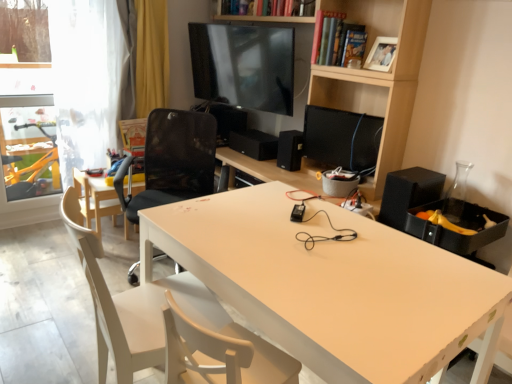
Question: Is white wood chair at lower left, marked as the third chair in a back-to-front arrangement, smaller than black mesh chair at center, which is the second chair in back-to-front order?

Choices:
 (A) no
 (B) yes

Answer: (B)

Question: Is the depth of white wood chair at lower left, which is the 1th chair from front to back, greater than that of black mesh chair at center, which is the second chair in back-to-front order?

Choices:
 (A) no
 (B) yes

Answer: (A)

Question: Is white wood chair at lower left, which is the 1th chair from front to back, outside black mesh chair at center, which is the second chair in front-to-back order?

Choices:
 (A) no
 (B) yes

Answer: (B)

Question: Is white wood chair at lower left, marked as the third chair in a back-to-front arrangement, not near black mesh chair at center, which is the second chair in back-to-front order?

Choices:
 (A) no
 (B) yes

Answer: (B)

Question: Is white wood chair at lower left, which is the 1th chair from front to back, placed right next to black mesh chair at center, which is the second chair in front-to-back order?

Choices:
 (A) no
 (B) yes

Answer: (A)

Question: In terms of height, does light wood chair at left, which ranks as the 1th chair in back-to-front order, look taller or shorter compared to black mesh chair at center, which is the second chair in back-to-front order?

Choices:
 (A) tall
 (B) short

Answer: (B)

Question: Is light wood chair at left, which ranks as the 1th chair in back-to-front order, spatially inside black mesh chair at center, which is the second chair in front-to-back order, or outside of it?

Choices:
 (A) inside
 (B) outside

Answer: (B)

Question: In terms of width, does light wood chair at left, which ranks as the 1th chair in back-to-front order, look wider or thinner when compared to black mesh chair at center, which is the second chair in back-to-front order?

Choices:
 (A) wide
 (B) thin

Answer: (B)

Question: In the image, is light wood chair at left, which ranks as the 1th chair in back-to-front order, on the left side or the right side of black mesh chair at center, which is the second chair in back-to-front order?

Choices:
 (A) left
 (B) right

Answer: (A)

Question: Does point (123, 163) appear closer or farther from the camera than point (379, 119)?

Choices:
 (A) farther
 (B) closer

Answer: (A)

Question: Which is correct: black mesh chair at center, which is the second chair in back-to-front order, is inside black matte computer monitor at center, or outside of it?

Choices:
 (A) outside
 (B) inside

Answer: (A)

Question: From the image's perspective, is black mesh chair at center, which is the second chair in front-to-back order, located above or below black matte computer monitor at center?

Choices:
 (A) below
 (B) above

Answer: (A)

Question: Considering the positions of black mesh chair at center, which is the second chair in front-to-back order, and black matte computer monitor at center in the image, is black mesh chair at center, which is the second chair in front-to-back order, bigger or smaller than black matte computer monitor at center?

Choices:
 (A) small
 (B) big

Answer: (B)

Question: Is hardcover book at upper center, placed as the first book when sorted from left to right, taller or shorter than black matte computer monitor at center?

Choices:
 (A) tall
 (B) short

Answer: (B)

Question: Considering their positions, is hardcover book at upper center, positioned as the second book in right-to-left order, located in front of or behind black matte computer monitor at center?

Choices:
 (A) front
 (B) behind

Answer: (B)